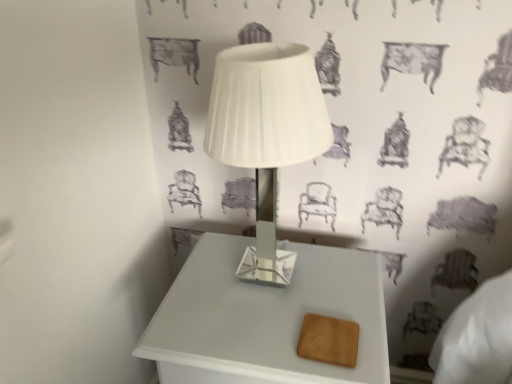
Question: Looking at their shapes, would you say white glossy lamp at center is wider or thinner than white glossy table at center?

Choices:
 (A) thin
 (B) wide

Answer: (A)

Question: From the image's perspective, is white glossy lamp at center located above or below white glossy table at center?

Choices:
 (A) below
 (B) above

Answer: (B)

Question: Considering the positions of white glossy lamp at center and white glossy table at center in the image, is white glossy lamp at center taller or shorter than white glossy table at center?

Choices:
 (A) tall
 (B) short

Answer: (B)

Question: Considering the positions of white glossy table at center and white glossy lamp at center in the image, is white glossy table at center bigger or smaller than white glossy lamp at center?

Choices:
 (A) small
 (B) big

Answer: (B)

Question: From the image's perspective, is white glossy table at center above or below white glossy lamp at center?

Choices:
 (A) above
 (B) below

Answer: (B)

Question: From a real-world perspective, is white glossy table at center above or below white glossy lamp at center?

Choices:
 (A) above
 (B) below

Answer: (B)

Question: Is point (333, 306) positioned closer to the camera than point (266, 173)?

Choices:
 (A) closer
 (B) farther

Answer: (A)